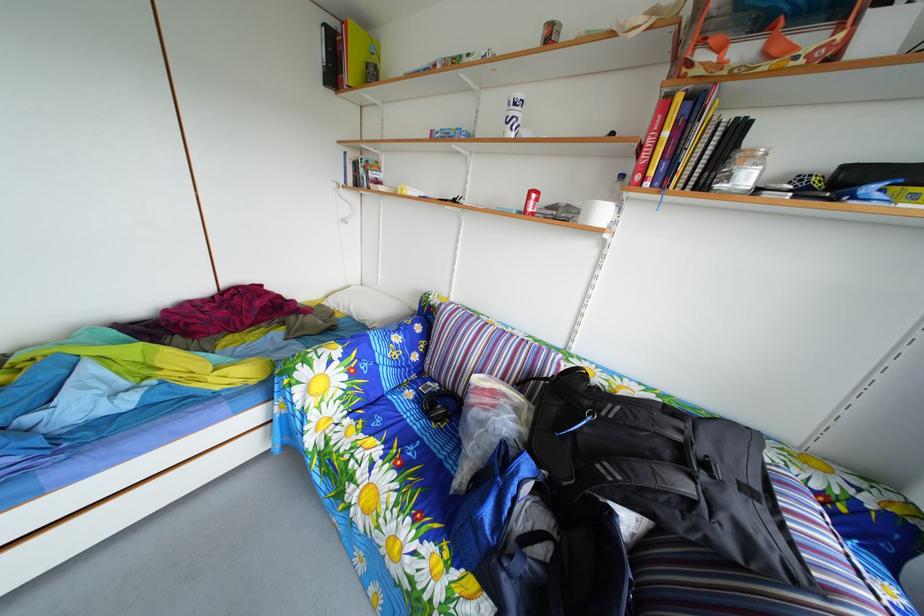
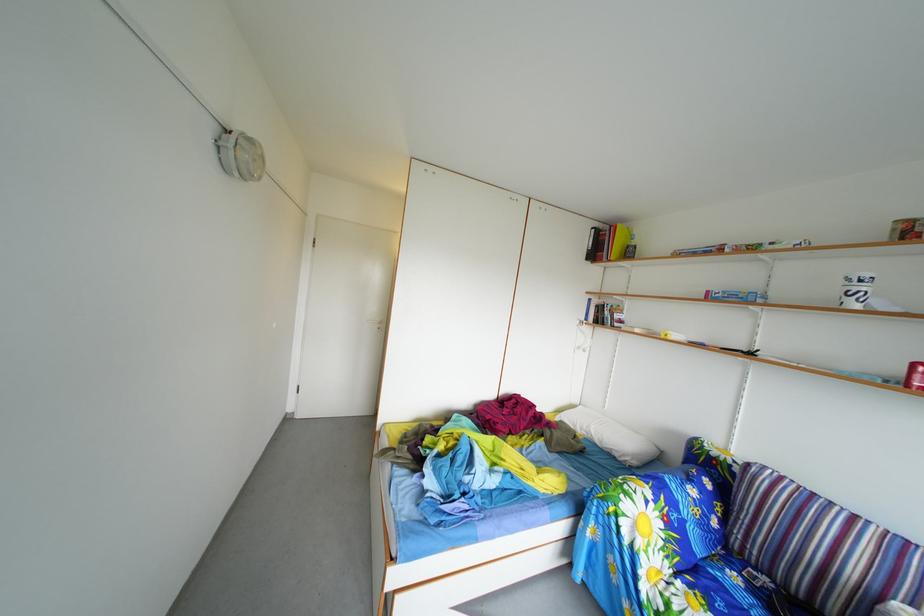
Based on the continuous images, in which direction is the camera rotating?

The rotation direction of the camera is left-up.